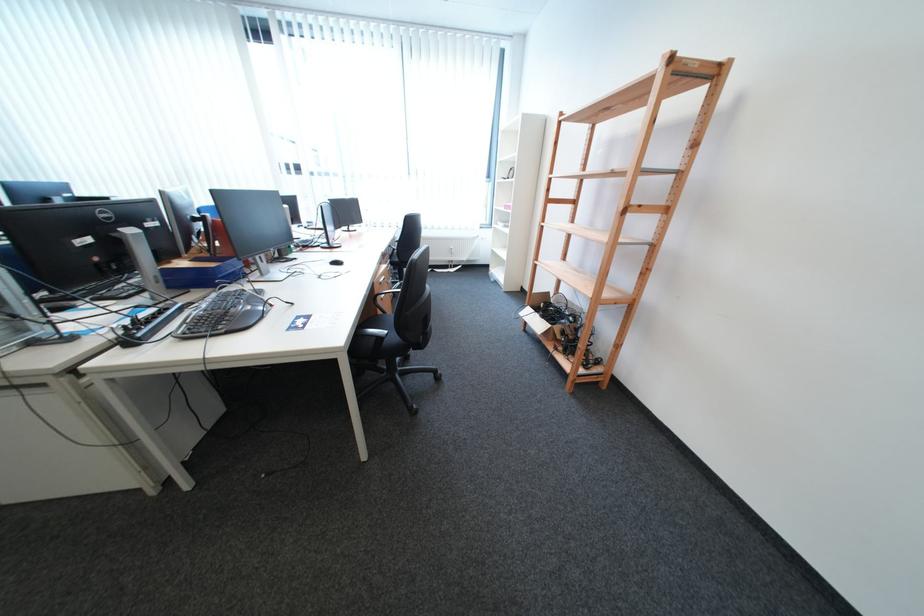
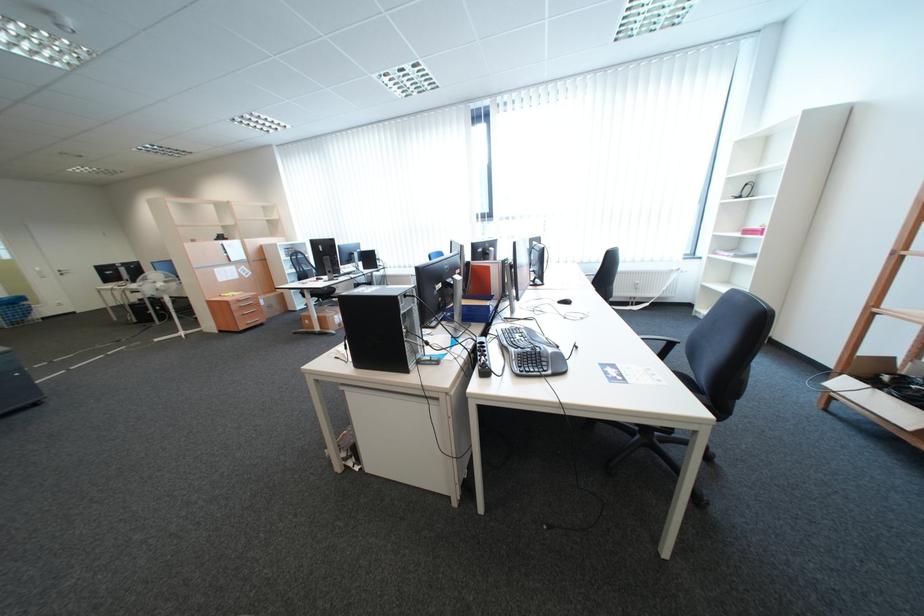
Where in the second image is the point corresponding to (x=517, y=208) from the first image?

(758, 233)